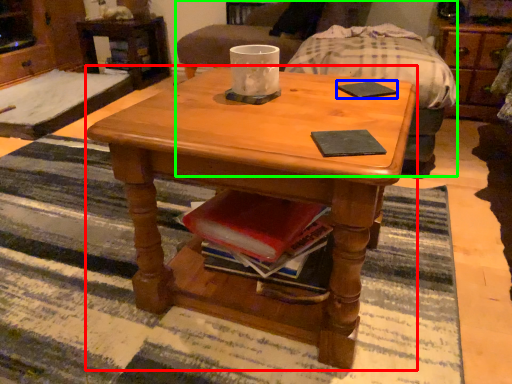
Question: Estimate the real-world distances between objects in this image. Which object is farther from coffee table (highlighted by a red box), pad (highlighted by a blue box) or armchair (highlighted by a green box)?

Choices:
 (A) pad
 (B) armchair

Answer: (B)